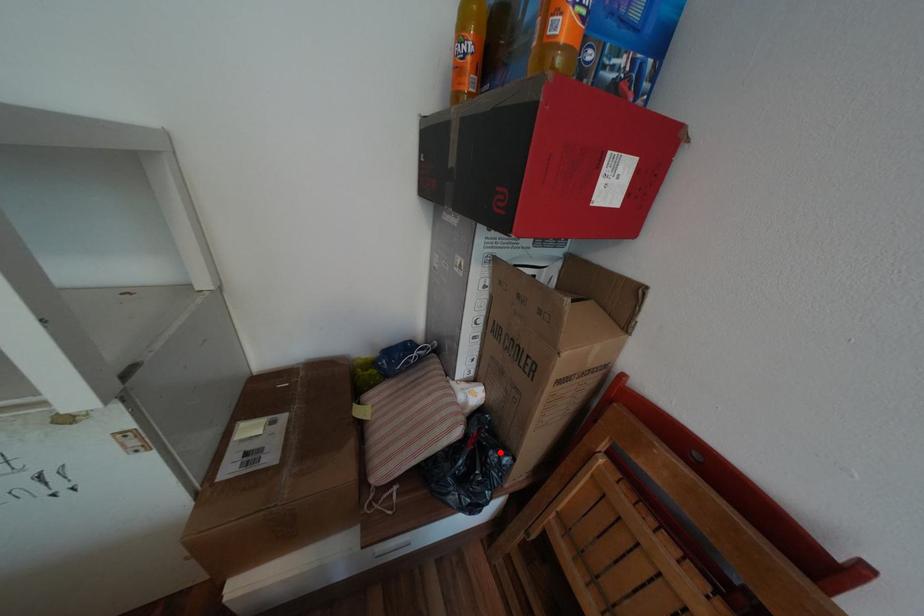
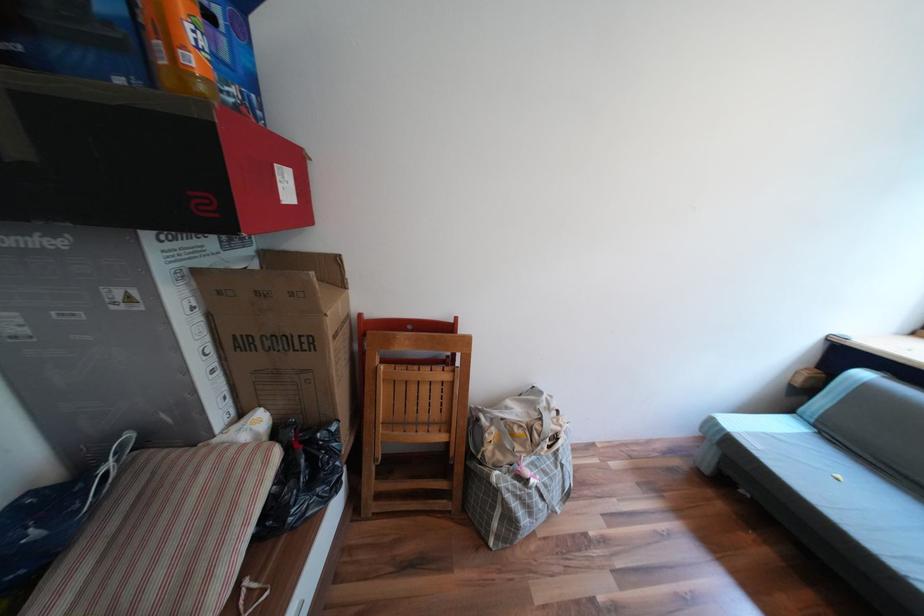
Where in the second image is the point corresponding to the highlighted location from the first image?

(327, 435)